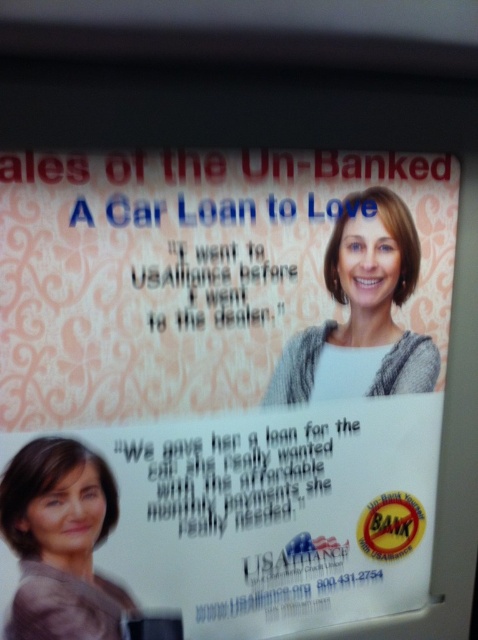
Does matte gray sweater at lower left appear on the left side of gray knitted sweater at center?

Yes, matte gray sweater at lower left is to the left of gray knitted sweater at center.

Is point (35, 493) farther from camera compared to point (311, 390)?

No, it is in front of (311, 390).

You are a GUI agent. You are given a task and a screenshot of the screen. Output one action in this format:
    pyautogui.click(x=<x>, y=<y>)
    Task: Click on the matte gray sweater at lower left
    
    Given the screenshot: What is the action you would take?
    pyautogui.click(x=61, y=541)

From the picture: Which is below, white paper poster at center or gray knitted sweater at center?

white paper poster at center

Between white paper poster at center and gray knitted sweater at center, which one appears on the left side from the viewer's perspective?

From the viewer's perspective, white paper poster at center appears more on the left side.

The width and height of the screenshot is (478, 640). What do you see at coordinates (239, 369) in the screenshot?
I see `white paper poster at center` at bounding box center [239, 369].

Where is `white paper poster at center`? white paper poster at center is located at coordinates (239, 369).

Is point (170, 568) positioned behind point (18, 634)?

Yes, point (170, 568) is farther from viewer.

Can you confirm if white paper poster at center is shorter than matte gray sweater at lower left?

In fact, white paper poster at center may be taller than matte gray sweater at lower left.

Measure the distance between white paper poster at center and camera.

A distance of 22.49 inches exists between white paper poster at center and camera.

Where is `white paper poster at center`? The image size is (478, 640). white paper poster at center is located at coordinates (239, 369).